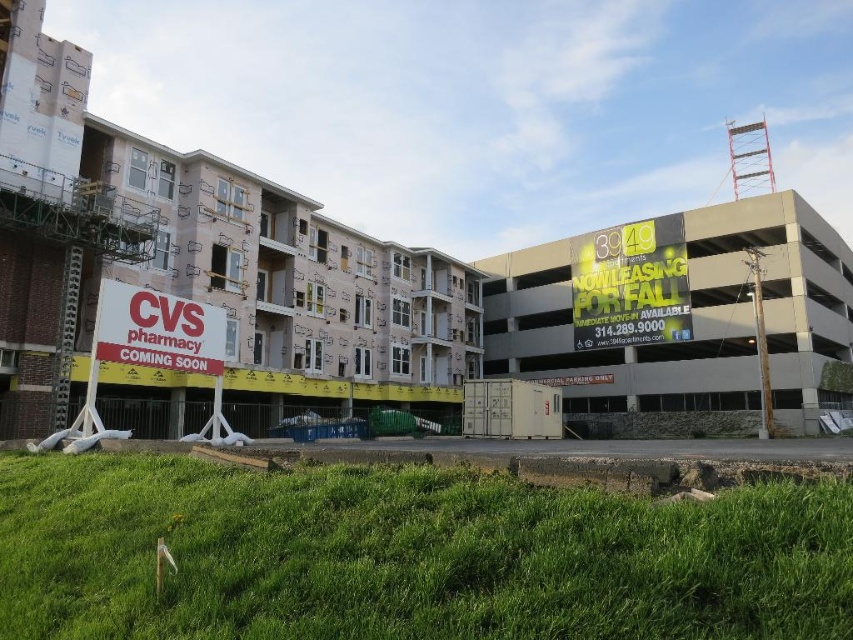
Question: Which object is positioned closest to the white plastic cvs pharmacy sign at lower left?

Choices:
 (A) yellow reflective sign at upper right
 (B) gray concrete parking garage at right

Answer: (A)

Question: Considering the real-world distances, which object is closest to the yellow reflective sign at upper right?

Choices:
 (A) gray concrete parking garage at right
 (B) white plastic cvs pharmacy sign at lower left

Answer: (A)

Question: Does gray concrete parking garage at right appear under white plastic cvs pharmacy sign at lower left?

Choices:
 (A) no
 (B) yes

Answer: (A)

Question: Which of the following is the closest to the observer?

Choices:
 (A) gray concrete parking garage at right
 (B) yellow reflective sign at upper right

Answer: (A)

Question: Is the position of gray concrete parking garage at right less distant than that of yellow reflective sign at upper right?

Choices:
 (A) yes
 (B) no

Answer: (A)

Question: Is gray concrete parking garage at right closer to camera compared to yellow reflective sign at upper right?

Choices:
 (A) yes
 (B) no

Answer: (A)